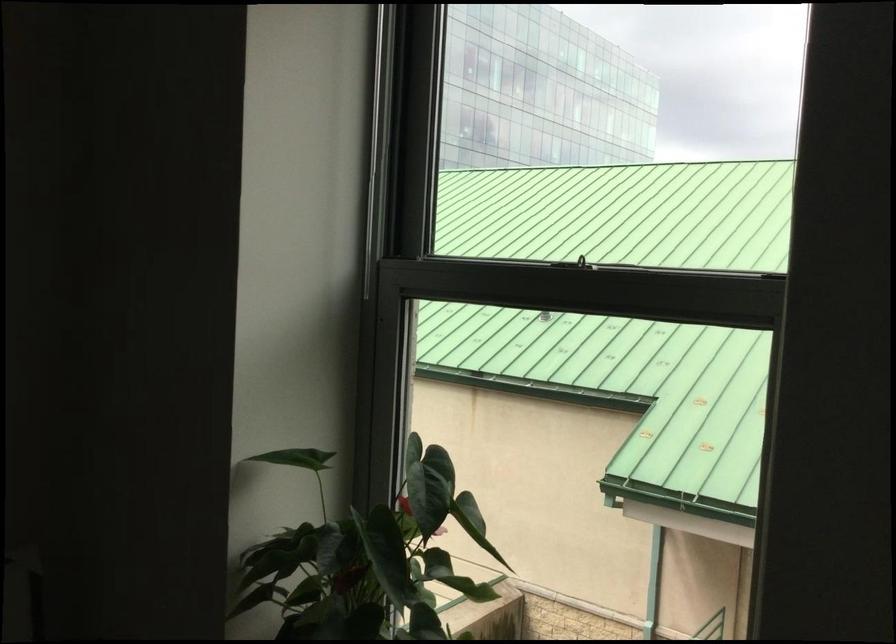
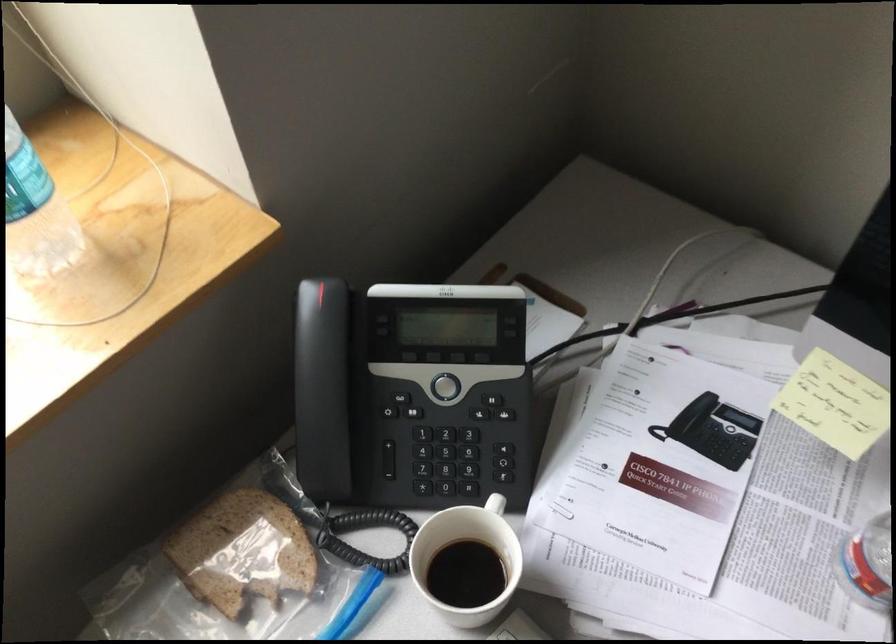
How did the camera likely rotate?

The camera rotated toward right-down.